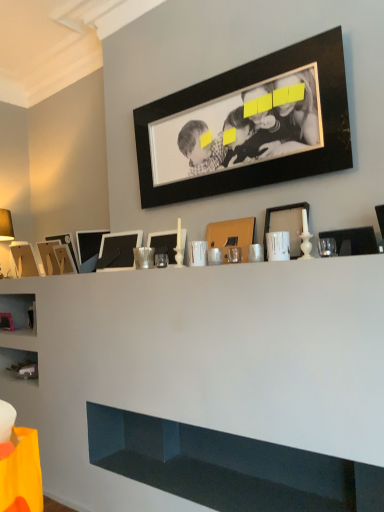
Question: Considering the relative sizes of matte black picture frame at left, which is the 4th picture frame from left to right, and black matte picture frame at center, the 5th picture frame in the left-to-right sequence, in the image provided, is matte black picture frame at left, which is the 4th picture frame from left to right, wider than black matte picture frame at center, the 5th picture frame in the left-to-right sequence,?

Choices:
 (A) no
 (B) yes

Answer: (B)

Question: Considering the relative sizes of matte black picture frame at left, placed as the seventh picture frame when sorted from right to left, and black matte picture frame at center, the 5th picture frame in the left-to-right sequence, in the image provided, is matte black picture frame at left, placed as the seventh picture frame when sorted from right to left, smaller than black matte picture frame at center, the 5th picture frame in the left-to-right sequence,?

Choices:
 (A) yes
 (B) no

Answer: (A)

Question: From the image's perspective, would you say matte black picture frame at left, placed as the seventh picture frame when sorted from right to left, is shown under black matte picture frame at center, which is the 6th picture frame in right-to-left order?

Choices:
 (A) yes
 (B) no

Answer: (A)

Question: Does matte black picture frame at left, which is the 4th picture frame from left to right, come in front of black matte picture frame at center, the 5th picture frame in the left-to-right sequence?

Choices:
 (A) yes
 (B) no

Answer: (B)

Question: From a real-world perspective, is matte black picture frame at left, placed as the seventh picture frame when sorted from right to left, physically below black matte picture frame at center, the 5th picture frame in the left-to-right sequence?

Choices:
 (A) yes
 (B) no

Answer: (B)

Question: Can you confirm if matte black picture frame at left, placed as the seventh picture frame when sorted from right to left, is positioned to the left of black matte picture frame at center, which is the 6th picture frame in right-to-left order?

Choices:
 (A) no
 (B) yes

Answer: (B)

Question: From the image's perspective, is matte cardboard picture frame at left, marked as the tenth picture frame in a right-to-left arrangement, on top of matte gold table lamp at left?

Choices:
 (A) yes
 (B) no

Answer: (B)

Question: From a real-world perspective, is matte cardboard picture frame at left, the 1th picture frame in the left-to-right sequence, beneath matte gold table lamp at left?

Choices:
 (A) yes
 (B) no

Answer: (A)

Question: Does matte cardboard picture frame at left, the 1th picture frame in the left-to-right sequence, have a lesser height compared to matte gold table lamp at left?

Choices:
 (A) yes
 (B) no

Answer: (A)

Question: Would you consider matte cardboard picture frame at left, the 1th picture frame in the left-to-right sequence, to be distant from matte gold table lamp at left?

Choices:
 (A) no
 (B) yes

Answer: (A)

Question: Is matte cardboard picture frame at left, marked as the tenth picture frame in a right-to-left arrangement, bigger than matte gold table lamp at left?

Choices:
 (A) yes
 (B) no

Answer: (B)

Question: Does matte cardboard picture frame at left, the 1th picture frame in the left-to-right sequence, have a greater height compared to matte gold table lamp at left?

Choices:
 (A) no
 (B) yes

Answer: (A)

Question: Is wooden picture frame at left, positioned as the 2th picture frame in left-to-right order, bigger than matte white picture frame at center, which is the second picture frame from right to left?

Choices:
 (A) no
 (B) yes

Answer: (B)